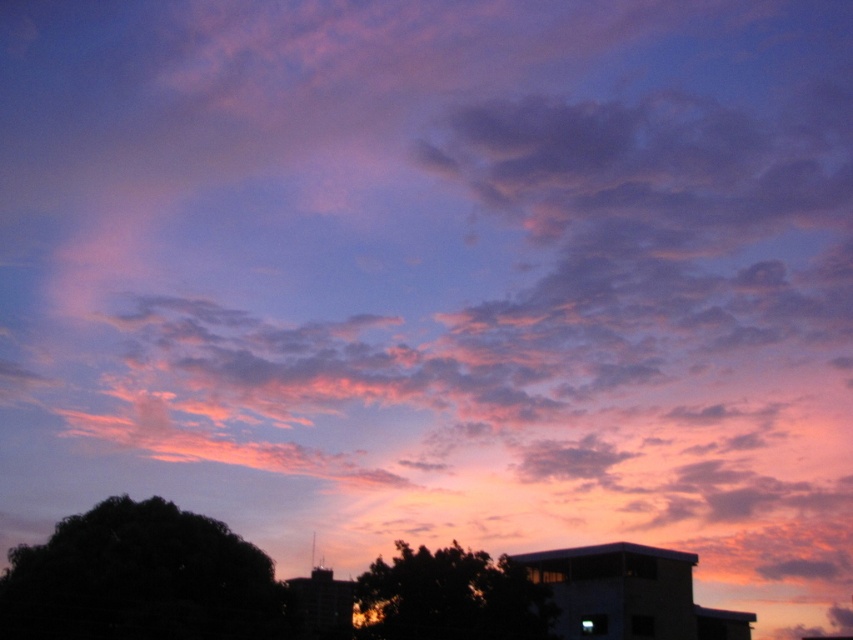
Question: Does dark green leafy tree at lower left have a lesser width compared to dark green leafy tree at center?

Choices:
 (A) yes
 (B) no

Answer: (B)

Question: From the image, what is the correct spatial relationship of dark green leafy tree at lower left in relation to dark green leafy tree at center?

Choices:
 (A) above
 (B) below

Answer: (A)

Question: Is dark green leafy tree at lower left positioned in front of dark green leafy tree at center?

Choices:
 (A) yes
 (B) no

Answer: (A)

Question: Which point is farther to the camera?

Choices:
 (A) dark green leafy tree at lower left
 (B) dark green leafy tree at center

Answer: (B)